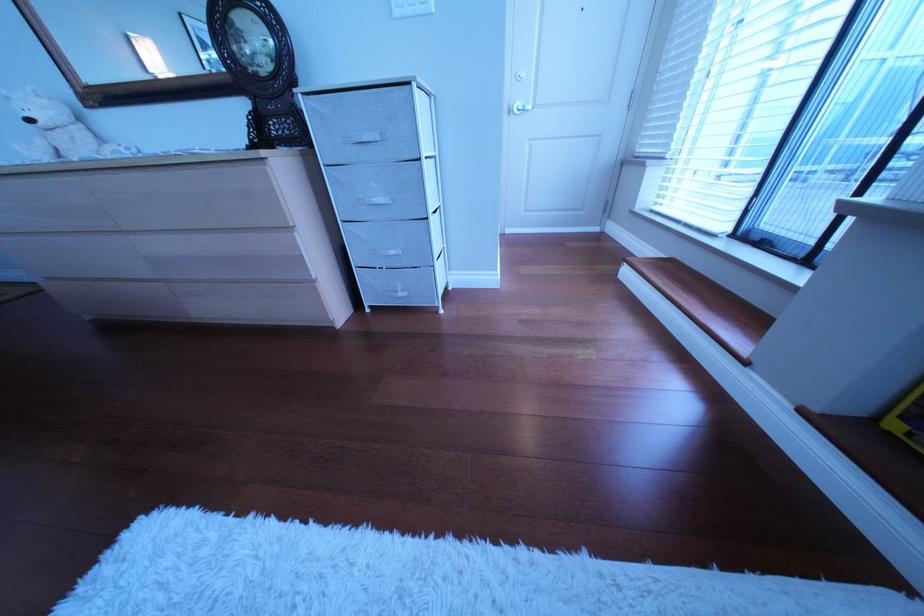
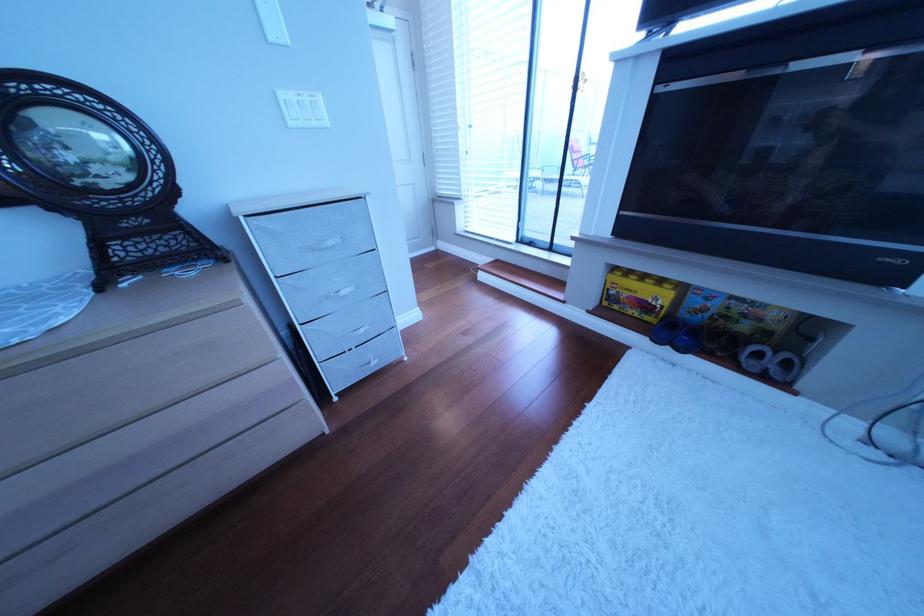
Locate, in the second image, the point that corresponds to (x=391, y=252) in the first image.

(358, 339)